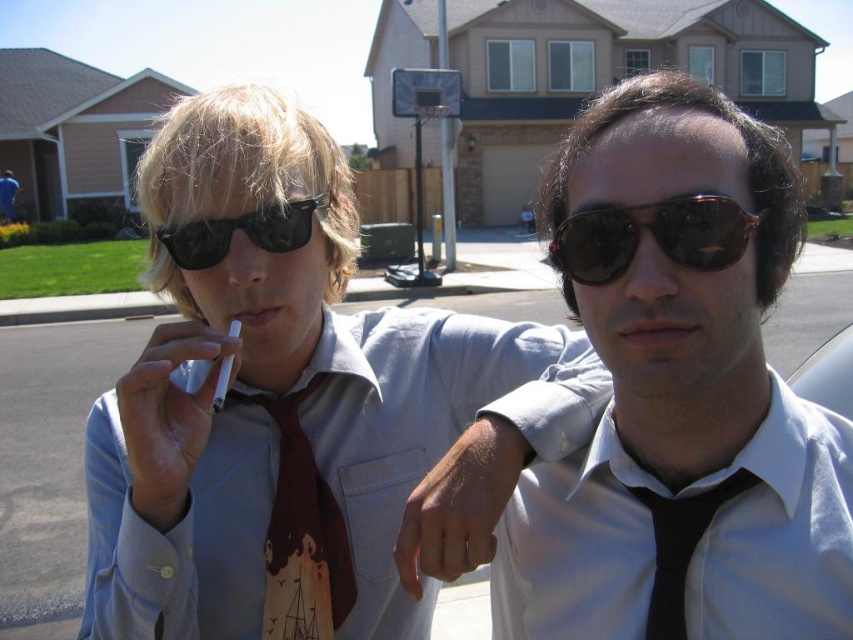
You are a tailor who needs to determine which object is bigger between the white smooth dress shirt at center and the white matte cigarette at center. Based on the scene, which one is larger?

The white smooth dress shirt at center is larger than the white matte cigarette at center according to the description.

You are a tailor measuring two items in the image. The items are the white smooth dress shirt at center and the white matte cigarette at center. Which item has a greater width?

The white smooth dress shirt at center has a greater width than the white matte cigarette at center, as stated in the description.